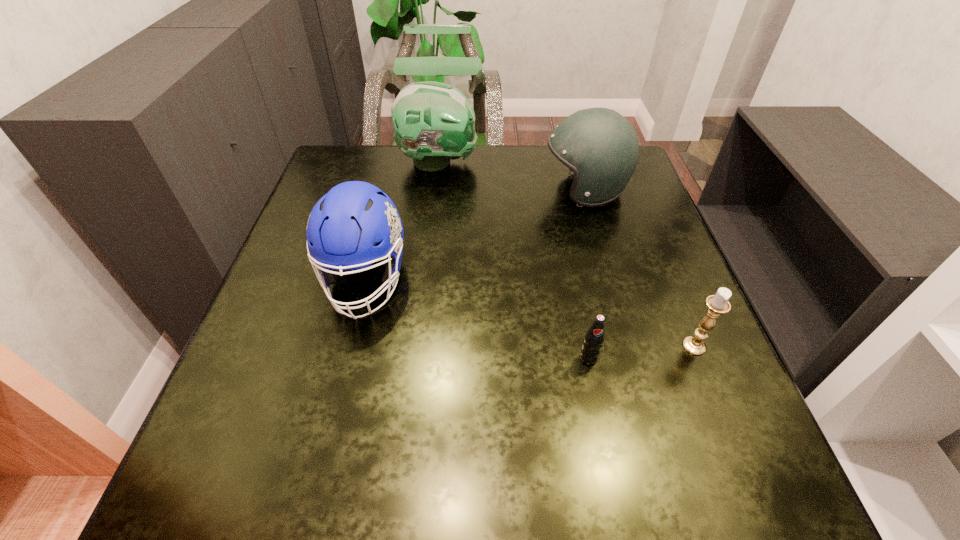
This screenshot has height=540, width=960. What are the coordinates of `object situated at the left edge` in the screenshot? It's located at (344, 224).

Locate an element on the screen. The width and height of the screenshot is (960, 540). football helmet that is at the right edge is located at coordinates (599, 145).

Locate an element on the screen. The width and height of the screenshot is (960, 540). candle holder located in the right edge section of the desktop is located at coordinates (718, 304).

Identify the location of object situated at the far right corner. The height and width of the screenshot is (540, 960). 599,145.

Image resolution: width=960 pixels, height=540 pixels. I want to click on free space at the far edge of the desktop, so click(464, 162).

Locate an element on the screen. free location at the left edge of the desktop is located at coordinates (322, 296).

This screenshot has width=960, height=540. In order to click on free space at the right edge of the desktop in this screenshot , I will do `click(639, 278)`.

Find the location of a particular element. The width and height of the screenshot is (960, 540). empty location between the pop and the third nearest object is located at coordinates (477, 319).

Where is `free spot between the rightmost football helmet and the pop`? Image resolution: width=960 pixels, height=540 pixels. free spot between the rightmost football helmet and the pop is located at coordinates (587, 274).

Where is `empty location between the third farthest object and the pop`? The image size is (960, 540). empty location between the third farthest object and the pop is located at coordinates (477, 319).